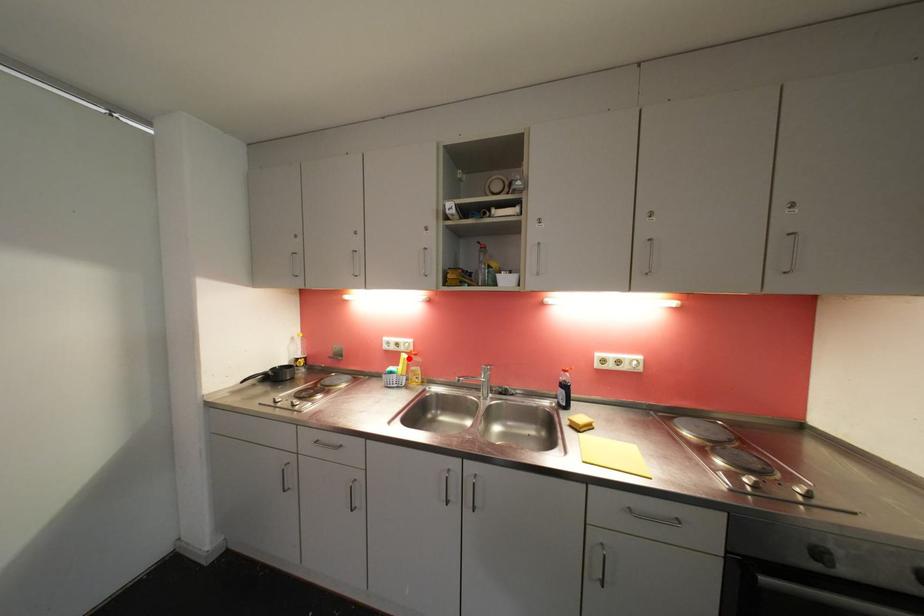
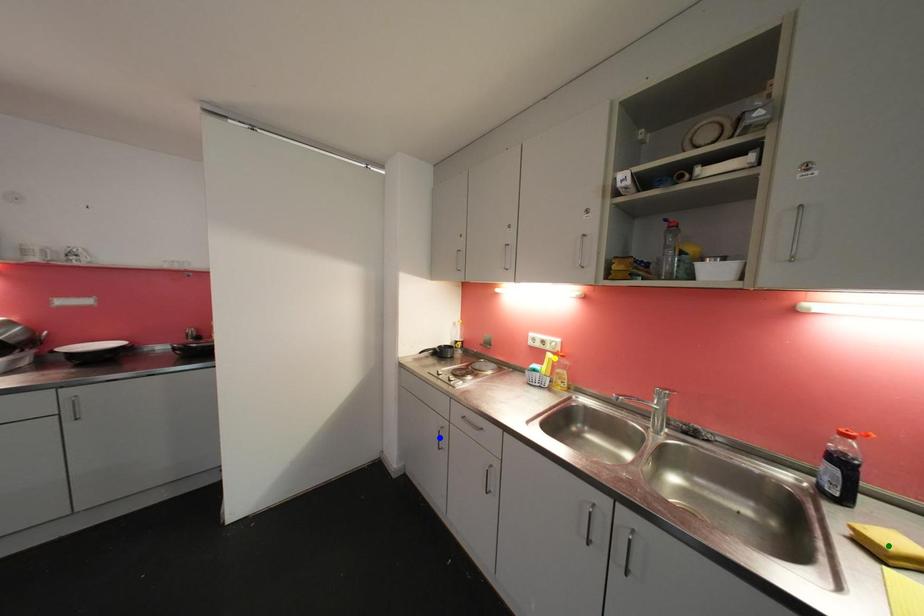
Question: I am providing you with two images of the same scene from different viewpoints. A red point is marked on the first image. You are given multiple points on the second image. Which point in image 2 is actually the same real-world point as the red point in image 1?

Choices:
 (A) green point
 (B) blue point
 (C) yellow point

Answer: (C)